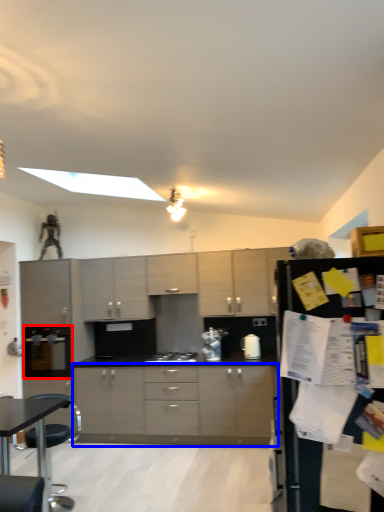
Question: Which point is closer to the camera, appliance (highlighted by a red box) or cabinetry (highlighted by a blue box)?

Choices:
 (A) appliance
 (B) cabinetry

Answer: (B)